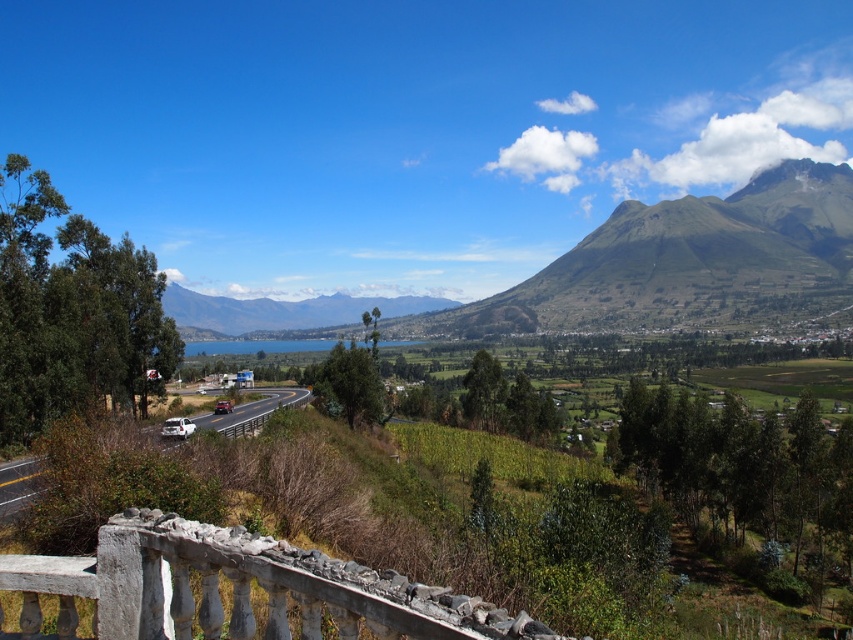
Question: Which of the following is the closest to the observer?

Choices:
 (A) green grassy mountain at upper center
 (B) white asphalt road at center-left

Answer: (B)

Question: Can you confirm if green grassy mountain at upper center is positioned below white asphalt road at center-left?

Choices:
 (A) no
 (B) yes

Answer: (A)

Question: Does green grassy mountain at upper center appear on the left side of white asphalt road at center-left?

Choices:
 (A) yes
 (B) no

Answer: (B)

Question: Among these points, which one is farthest from the camera?

Choices:
 (A) (752, 284)
 (B) (10, 509)

Answer: (A)

Question: Does green grassy mountain at upper center come behind white asphalt road at center-left?

Choices:
 (A) yes
 (B) no

Answer: (A)

Question: Which of the following is the closest to the observer?

Choices:
 (A) green grassy mountain at upper center
 (B) white asphalt road at center-left

Answer: (B)